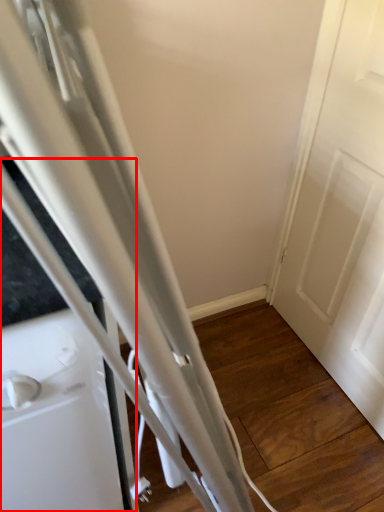
Question: From the image's perspective, what is the correct spatial positioning of appliance (annotated by the red box) in reference to door?

Choices:
 (A) above
 (B) below

Answer: (B)